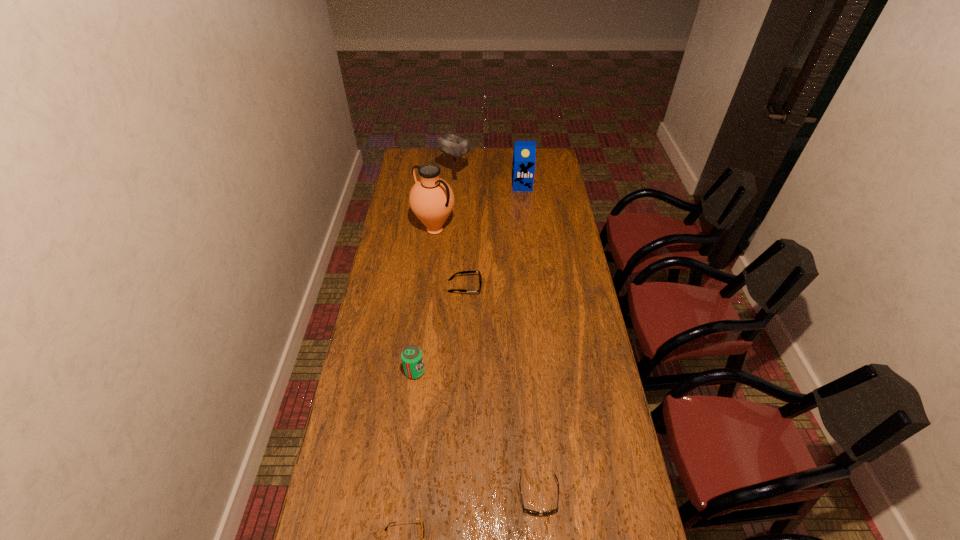
In order to click on free spot that satisfies the following two spatial constraints: 1. on the front side of the fifth nearest object; 2. on the front-facing side of the pop soda in this screenshot , I will do `click(419, 372)`.